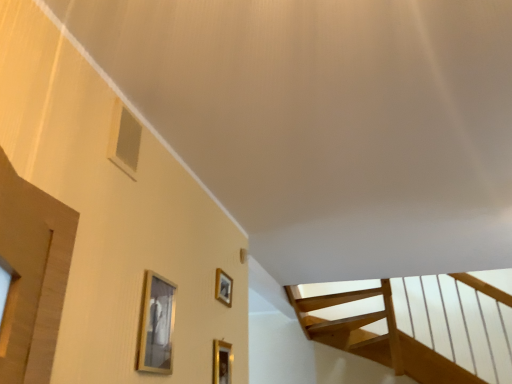
Question: Is the depth of matte silver picture frame at center, acting as the third picture frame starting from the front, greater than that of gold metallic picture frame at lower center, positioned as the second picture frame in back-to-front order?

Choices:
 (A) no
 (B) yes

Answer: (B)

Question: From a real-world perspective, is matte silver picture frame at center, positioned as the first picture frame in back-to-front order, physically above gold metallic picture frame at lower center, positioned as the second picture frame in back-to-front order?

Choices:
 (A) yes
 (B) no

Answer: (A)

Question: Can you confirm if matte silver picture frame at center, the second picture frame positioned from the right, is bigger than gold metallic picture frame at lower center, the 3th picture frame viewed from the left?

Choices:
 (A) no
 (B) yes

Answer: (A)

Question: Considering the relative sizes of matte silver picture frame at center, acting as the third picture frame starting from the front, and gold metallic picture frame at lower center, positioned as the second picture frame in back-to-front order, in the image provided, is matte silver picture frame at center, acting as the third picture frame starting from the front, wider than gold metallic picture frame at lower center, positioned as the second picture frame in back-to-front order,?

Choices:
 (A) yes
 (B) no

Answer: (A)

Question: Is matte silver picture frame at center, acting as the third picture frame starting from the front, in front of gold metallic picture frame at lower center, the 3th picture frame viewed from the left?

Choices:
 (A) yes
 (B) no

Answer: (B)

Question: Is gold metallic picture frame at lower center, positioned as the second picture frame in back-to-front order, spatially inside matte silver picture frame at center, placed as the 2th picture frame when sorted from left to right, or outside of it?

Choices:
 (A) inside
 (B) outside

Answer: (B)

Question: Is point (222, 354) positioned closer to the camera than point (226, 278)?

Choices:
 (A) farther
 (B) closer

Answer: (B)

Question: Considering the positions of gold metallic picture frame at lower center, positioned as the second picture frame in back-to-front order, and matte silver picture frame at center, positioned as the first picture frame in back-to-front order, in the image, is gold metallic picture frame at lower center, positioned as the second picture frame in back-to-front order, taller or shorter than matte silver picture frame at center, positioned as the first picture frame in back-to-front order,?

Choices:
 (A) short
 (B) tall

Answer: (B)

Question: From the image's perspective, relative to matte silver picture frame at center, positioned as the first picture frame in back-to-front order, is gold metallic picture frame at lower center, positioned as the second picture frame in front-to-back order, above or below?

Choices:
 (A) above
 (B) below

Answer: (B)

Question: Relative to gold metallic picture frame at lower center, positioned as the second picture frame in back-to-front order, is gold metallic picture frame at lower center, which is counted as the third picture frame, starting from the back, in front or behind?

Choices:
 (A) front
 (B) behind

Answer: (A)

Question: From the image's perspective, relative to gold metallic picture frame at lower center, the 1th picture frame from the right, is gold metallic picture frame at lower center, the 1th picture frame positioned from the front, above or below?

Choices:
 (A) below
 (B) above

Answer: (B)

Question: From a real-world perspective, relative to gold metallic picture frame at lower center, positioned as the second picture frame in front-to-back order, is gold metallic picture frame at lower center, which appears as the 1th picture frame when viewed from the left, vertically above or below?

Choices:
 (A) below
 (B) above

Answer: (B)

Question: Considering the positions of gold metallic picture frame at lower center, marked as the 3th picture frame in a right-to-left arrangement, and gold metallic picture frame at lower center, the 1th picture frame from the right, in the image, is gold metallic picture frame at lower center, marked as the 3th picture frame in a right-to-left arrangement, wider or thinner than gold metallic picture frame at lower center, the 1th picture frame from the right,?

Choices:
 (A) wide
 (B) thin

Answer: (A)

Question: Is point (218, 279) closer or farther from the camera than point (163, 292)?

Choices:
 (A) closer
 (B) farther

Answer: (B)

Question: From the image's perspective, is matte silver picture frame at center, positioned as the first picture frame in back-to-front order, above or below gold metallic picture frame at lower center, which appears as the 1th picture frame when viewed from the left?

Choices:
 (A) above
 (B) below

Answer: (B)